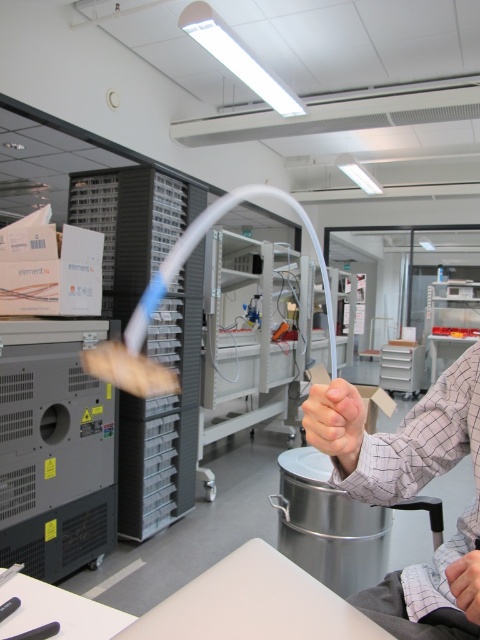
You are standing in the laboratory and want to reach the point at coordinates (199, 234). The lab has a safety rule that states you must stay at least 3 meters away from all equipment to avoid interference. Can you safely stand at that point without violating the rule?

The point at coordinates (199, 234) is exactly 3.05 meters from the viewer, which is just over the required 3 meters distance. Therefore, you can safely stand there without violating the safety rule.

From the picture: You are an assistant in the lab and need to determine the relative size of the transparent plastic tube at center and the matte skin hand at center. Which object is taller?

→ The transparent plastic tube at center is taller than the matte skin hand at center.

You are a lab technician who needs to place a small vial on the white matte table at lower center. Your hand, which is holding the vial, is currently at the smooth skin hand at lower right. Can you reach the table without moving your body?

The distance between the white matte table at lower center and the smooth skin hand at lower right is 21.52 centimeters. Since the average human hand can typically reach about 20 centimeters without moving the body, you might need to adjust your position slightly to place the vial on the table.